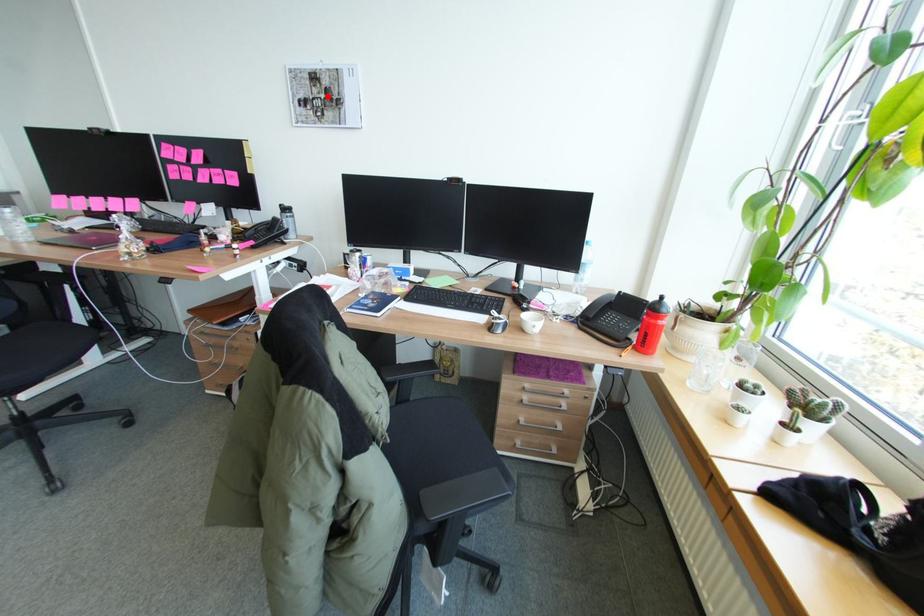
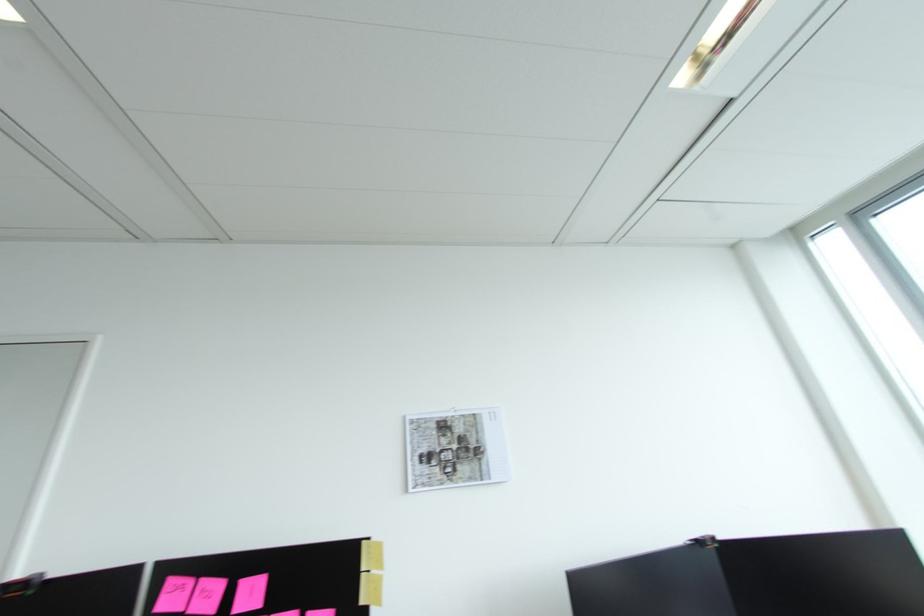
Question: I am providing you with two images of the same scene from different viewpoints. Given a red point in image1, look at the same physical point in image2. Is it:

Choices:
 (A) Closer to the viewpoint
 (B) Farther from the viewpoint

Answer: (B)